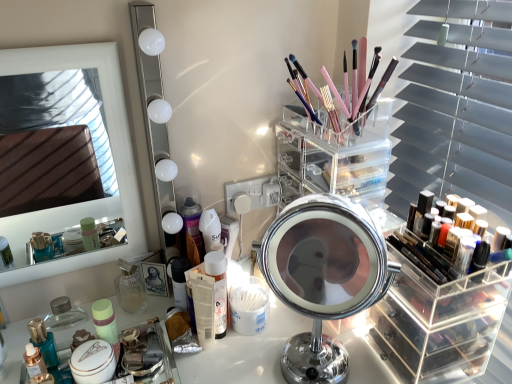
This screenshot has height=384, width=512. In order to click on white glossy mirror at upper left, the 3th mirror in the right-to-left sequence in this screenshot , I will do `click(57, 127)`.

What do you see at coordinates (154, 281) in the screenshot?
I see `matte black makeup artist at center` at bounding box center [154, 281].

Describe the element at coordinates (329, 161) in the screenshot. This screenshot has width=512, height=384. I see `clear acrylic organizer at center, positioned as the 1th shelf in left-to-right order` at that location.

Locate an element on the screen. clear acrylic organizer at center, placed as the first shelf when sorted from top to bottom is located at coordinates (329, 161).

This screenshot has height=384, width=512. In order to click on shiny black nail polish at right, acting as the fourth toiletry starting from the left in this screenshot , I will do `click(422, 210)`.

What do you see at coordinates (439, 320) in the screenshot? I see `clear acrylic makeup organizer at right, marked as the 1th shelf in a bottom-to-top arrangement` at bounding box center [439, 320].

What is the approximate height of white glossy mirror at upper left, the second mirror viewed from the left?

white glossy mirror at upper left, the second mirror viewed from the left, is 54.81 centimeters in height.

Image resolution: width=512 pixels, height=384 pixels. Find the location of `white glossy mirror at upper left, the first mirror from the left`. white glossy mirror at upper left, the first mirror from the left is located at coordinates (57, 127).

Between point (278, 222) and point (162, 291), which one is positioned in front?

The point (278, 222) is in front.

Considering the positions of objects chrome/metallic mirror at center, marked as the third mirror in a left-to-right arrangement, and matte black makeup artist at center in the image provided, who is more to the right, chrome/metallic mirror at center, marked as the third mirror in a left-to-right arrangement, or matte black makeup artist at center?

Positioned to the right is chrome/metallic mirror at center, marked as the third mirror in a left-to-right arrangement.

Can you confirm if chrome/metallic mirror at center, arranged as the 1th mirror when viewed from the right, is bigger than matte black makeup artist at center?

Yes.

Based on the photo, is chrome/metallic mirror at center, marked as the third mirror in a left-to-right arrangement, beside matte black makeup artist at center?

chrome/metallic mirror at center, marked as the third mirror in a left-to-right arrangement, and matte black makeup artist at center are not in contact.

Locate an element on the screen. The width and height of the screenshot is (512, 384). toiletry above the chrome/metallic mirror at center, marked as the third mirror in a left-to-right arrangement (from the image's perspective) is located at coordinates (422, 210).

Consider the image. Which is nearer, (358, 205) or (430, 203)?

Point (358, 205)

Considering the sizes of objects chrome/metallic mirror at center, arranged as the 1th mirror when viewed from the right, and shiny black nail polish at right, marked as the 1th toiletry in a right-to-left arrangement, in the image provided, who is thinner, chrome/metallic mirror at center, arranged as the 1th mirror when viewed from the right, or shiny black nail polish at right, marked as the 1th toiletry in a right-to-left arrangement,?

With smaller width is shiny black nail polish at right, marked as the 1th toiletry in a right-to-left arrangement.

Considering the relative sizes of matte black makeup artist at center and shiny metallic perfume at lower left, the 4th toiletry viewed from the right, in the image provided, is matte black makeup artist at center taller than shiny metallic perfume at lower left, the 4th toiletry viewed from the right,?

No, matte black makeup artist at center is not taller than shiny metallic perfume at lower left, the 4th toiletry viewed from the right.

From the picture: Considering the relative sizes of matte black makeup artist at center and shiny metallic perfume at lower left, the 4th toiletry viewed from the right, in the image provided, is matte black makeup artist at center smaller than shiny metallic perfume at lower left, the 4th toiletry viewed from the right,?

Yes.

Is matte black makeup artist at center oriented away from shiny metallic perfume at lower left, the 1th toiletry viewed from the left?

No, matte black makeup artist at center is not facing away from shiny metallic perfume at lower left, the 1th toiletry viewed from the left.

Is clear glass perfume at center, the third toiletry from the right, located outside chrome/metallic mirror at center, arranged as the 1th mirror when viewed from the right?

Yes.

Does clear glass perfume at center, marked as the 2th toiletry in a left-to-right arrangement, have a lesser height compared to chrome/metallic mirror at center, marked as the third mirror in a left-to-right arrangement?

Yes, clear glass perfume at center, marked as the 2th toiletry in a left-to-right arrangement, is shorter than chrome/metallic mirror at center, marked as the third mirror in a left-to-right arrangement.

From a real-world perspective, which is physically above, clear glass perfume at center, marked as the 2th toiletry in a left-to-right arrangement, or chrome/metallic mirror at center, marked as the third mirror in a left-to-right arrangement?

chrome/metallic mirror at center, marked as the third mirror in a left-to-right arrangement.

Which of these two, clear glass perfume at center, the third toiletry from the right, or chrome/metallic mirror at center, marked as the third mirror in a left-to-right arrangement, is bigger?

chrome/metallic mirror at center, marked as the third mirror in a left-to-right arrangement, is bigger.

From the picture: Would you say shiny black nail polish at right, acting as the fourth toiletry starting from the left, is outside white glossy mirror at upper left, the 3th mirror in the right-to-left sequence?

Indeed, shiny black nail polish at right, acting as the fourth toiletry starting from the left, is completely outside white glossy mirror at upper left, the 3th mirror in the right-to-left sequence.

Based on the photo, is white glossy mirror at upper left, the first mirror from the left, at the back of shiny black nail polish at right, marked as the 1th toiletry in a right-to-left arrangement?

No, shiny black nail polish at right, marked as the 1th toiletry in a right-to-left arrangement,'s orientation is not away from white glossy mirror at upper left, the first mirror from the left.

Considering the positions of objects shiny black nail polish at right, acting as the fourth toiletry starting from the left, and white glossy mirror at upper left, the first mirror from the left, in the image provided, who is more to the right, shiny black nail polish at right, acting as the fourth toiletry starting from the left, or white glossy mirror at upper left, the first mirror from the left,?

shiny black nail polish at right, acting as the fourth toiletry starting from the left.

Between shiny black nail polish at right, acting as the fourth toiletry starting from the left, and white glossy mirror at upper left, the 3th mirror in the right-to-left sequence, which one is positioned in front?

white glossy mirror at upper left, the 3th mirror in the right-to-left sequence, is more forward.

Does point (46, 217) appear closer or farther from the camera than point (219, 261)?

Point (46, 217).

From a real-world perspective, is white glossy mirror at upper left, the first mirror from the left, above or below matte plastic lotion at center, the 2th toiletry from the right?

white glossy mirror at upper left, the first mirror from the left, is above matte plastic lotion at center, the 2th toiletry from the right.

How far apart are white glossy mirror at upper left, the first mirror from the left, and matte plastic lotion at center, the 2th toiletry from the right?

white glossy mirror at upper left, the first mirror from the left, and matte plastic lotion at center, the 2th toiletry from the right, are 1.15 meters apart.

Image resolution: width=512 pixels, height=384 pixels. I want to click on the 4th toiletry below the white glossy mirror at upper left, the first mirror from the left (from a real-world perspective), so click(218, 289).

Where is `toiletry that is the 3rd object located below the shiny black nail polish at right, marked as the 1th toiletry in a right-to-left arrangement (from the image's perspective)`? This screenshot has height=384, width=512. toiletry that is the 3rd object located below the shiny black nail polish at right, marked as the 1th toiletry in a right-to-left arrangement (from the image's perspective) is located at coordinates (63, 318).

Choose the correct answer: Is shiny metallic perfume at lower left, the 4th toiletry viewed from the right, inside shiny black nail polish at right, marked as the 1th toiletry in a right-to-left arrangement, or outside it?

shiny metallic perfume at lower left, the 4th toiletry viewed from the right, exists outside the volume of shiny black nail polish at right, marked as the 1th toiletry in a right-to-left arrangement.

Consider the image. Does shiny metallic perfume at lower left, the 4th toiletry viewed from the right, appear on the right side of shiny black nail polish at right, marked as the 1th toiletry in a right-to-left arrangement?

In fact, shiny metallic perfume at lower left, the 4th toiletry viewed from the right, is to the left of shiny black nail polish at right, marked as the 1th toiletry in a right-to-left arrangement.

Does shiny metallic perfume at lower left, the 1th toiletry viewed from the left, touch shiny black nail polish at right, marked as the 1th toiletry in a right-to-left arrangement?

shiny metallic perfume at lower left, the 1th toiletry viewed from the left, and shiny black nail polish at right, marked as the 1th toiletry in a right-to-left arrangement, are clearly separated.

You are a GUI agent. You are given a task and a screenshot of the screen. Output one action in this format:
    pyautogui.click(x=<x>, y=<y>)
    Task: Click on the makeup artist on the left of chrome/metallic mirror at center, arranged as the 1th mirror when viewed from the right
    
    Given the screenshot: What is the action you would take?
    pyautogui.click(x=154, y=281)

Where is `the 3rd mirror in front of the shiny black nail polish at right, marked as the 1th toiletry in a right-to-left arrangement, counting from the anchor's position`? This screenshot has width=512, height=384. the 3rd mirror in front of the shiny black nail polish at right, marked as the 1th toiletry in a right-to-left arrangement, counting from the anchor's position is located at coordinates (323, 277).

Estimate the real-world distances between objects in this image. Which object is closer to chrome/metallic mirror at center, marked as the third mirror in a left-to-right arrangement, white glossy mirror at upper left, the 3th mirror in the right-to-left sequence, or clear acrylic organizer at center, placed as the first shelf when sorted from top to bottom?

The object closer to chrome/metallic mirror at center, marked as the third mirror in a left-to-right arrangement, is clear acrylic organizer at center, placed as the first shelf when sorted from top to bottom.

From the image, which object appears to be farther from clear acrylic organizer at center, positioned as the 1th shelf in left-to-right order, matte black makeup artist at center or clear glass perfume at center, marked as the 2th toiletry in a left-to-right arrangement?

clear glass perfume at center, marked as the 2th toiletry in a left-to-right arrangement, is positioned further to the anchor clear acrylic organizer at center, positioned as the 1th shelf in left-to-right order.

When comparing their distances from clear acrylic makeup organizer at right, which is the 2th shelf from top to bottom, does shiny black nail polish at right, marked as the 1th toiletry in a right-to-left arrangement, or matte plastic lotion at center, the third toiletry from the left, seem further?

matte plastic lotion at center, the third toiletry from the left.

When comparing their distances from clear acrylic makeup organizer at right, acting as the second shelf starting from the left, does chrome/metallic mirror at center, arranged as the 1th mirror when viewed from the right, or white glossy mirror at upper left, the 3th mirror in the right-to-left sequence, seem further?

The object further to clear acrylic makeup organizer at right, acting as the second shelf starting from the left, is white glossy mirror at upper left, the 3th mirror in the right-to-left sequence.

Which object lies further to the anchor point clear glass perfume at center, marked as the 2th toiletry in a left-to-right arrangement, clear acrylic makeup organizer at right, marked as the 1th shelf in a bottom-to-top arrangement, or clear acrylic organizer at center, acting as the 2th shelf starting from the bottom?

clear acrylic makeup organizer at right, marked as the 1th shelf in a bottom-to-top arrangement, is further to clear glass perfume at center, marked as the 2th toiletry in a left-to-right arrangement.

In the scene shown: When comparing their distances from white glossy mirror at upper left, the first mirror from the left, does chrome/metallic mirror at center, arranged as the 1th mirror when viewed from the right, or white glossy mirror at upper left, the second mirror viewed from the left, seem further?

chrome/metallic mirror at center, arranged as the 1th mirror when viewed from the right, is positioned further to the anchor white glossy mirror at upper left, the first mirror from the left.

Looking at the image, which one is located further to shiny black nail polish at right, marked as the 1th toiletry in a right-to-left arrangement, white glossy mirror at upper left, the 2th mirror from the right, or clear acrylic organizer at center, placed as the first shelf when sorted from top to bottom?

The object further to shiny black nail polish at right, marked as the 1th toiletry in a right-to-left arrangement, is white glossy mirror at upper left, the 2th mirror from the right.

Considering their positions, is shiny black nail polish at right, marked as the 1th toiletry in a right-to-left arrangement, positioned further to matte black makeup artist at center than clear glass perfume at center, the third toiletry from the right?

The object further to matte black makeup artist at center is shiny black nail polish at right, marked as the 1th toiletry in a right-to-left arrangement.

Where is `mirror between clear glass perfume at center, marked as the 2th toiletry in a left-to-right arrangement, and chrome/metallic mirror at center, marked as the third mirror in a left-to-right arrangement`? The image size is (512, 384). mirror between clear glass perfume at center, marked as the 2th toiletry in a left-to-right arrangement, and chrome/metallic mirror at center, marked as the third mirror in a left-to-right arrangement is located at coordinates (150, 119).

Where is `mirror situated between shiny metallic perfume at lower left, the 1th toiletry viewed from the left, and chrome/metallic mirror at center, marked as the third mirror in a left-to-right arrangement, from left to right`? The image size is (512, 384). mirror situated between shiny metallic perfume at lower left, the 1th toiletry viewed from the left, and chrome/metallic mirror at center, marked as the third mirror in a left-to-right arrangement, from left to right is located at coordinates (150, 119).

Identify the location of toiletry between matte black makeup artist at center and clear acrylic organizer at center, placed as the first shelf when sorted from top to bottom, in the horizontal direction. (218, 289).

This screenshot has height=384, width=512. I want to click on shelf situated between matte black makeup artist at center and clear acrylic makeup organizer at right, acting as the first shelf starting from the right, from left to right, so click(329, 161).